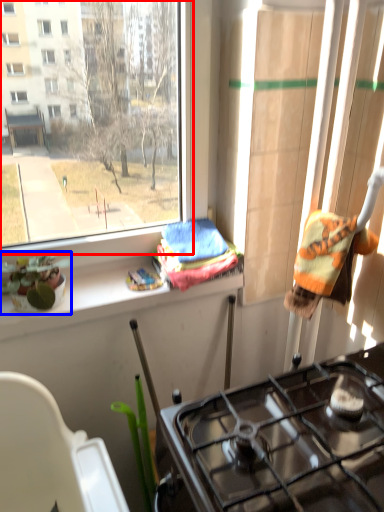
Question: Among these objects, which one is nearest to the camera, window (highlighted by a red box) or houseplant (highlighted by a blue box)?

Choices:
 (A) window
 (B) houseplant

Answer: (A)